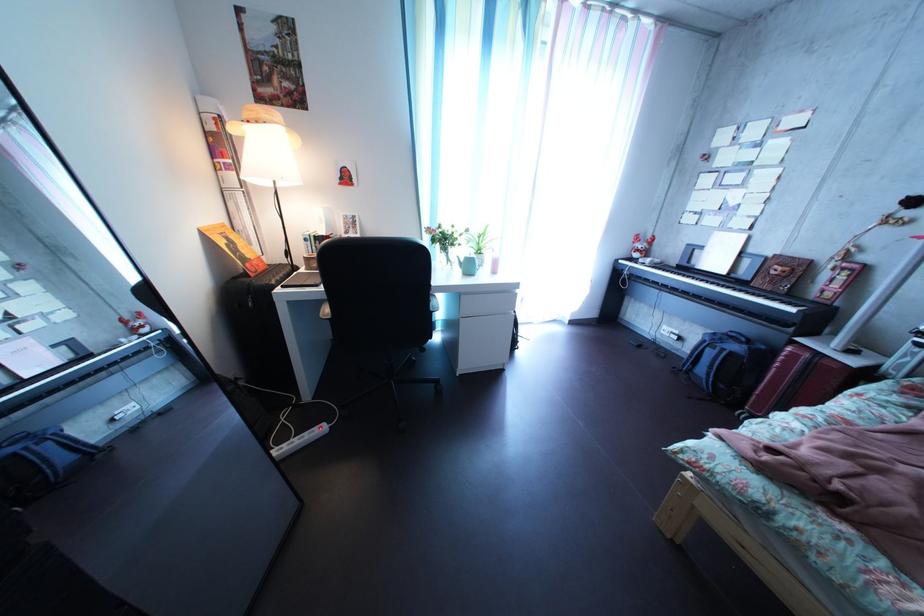
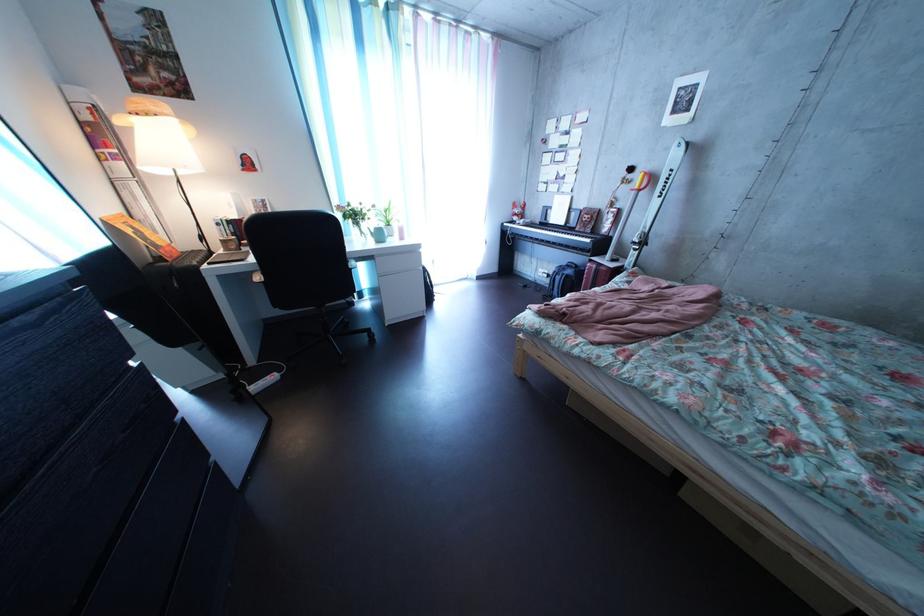
Question: What movement of the cameraman would produce the second image?

Choices:
 (A) Left
 (B) Right
 (C) Forward
 (D) Backward

Answer: (D)